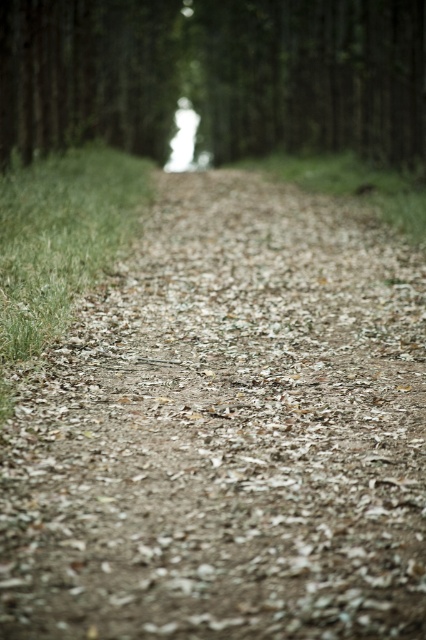
You are a gardener with a 1.5 meter wide lawnmower. You need to mow the area between the brown dirt track at center and the green matte tree at center. Is your lawnmower wide enough to fit through the space between them?

The brown dirt track at center is narrower than the green matte tree at center. However, the question is about the space between them, but the description only states their widths relative to each other, not the distance between them. Therefore, it is impossible to determine if the lawnmower can fit based on the given information.

You are a hiker walking along the narrow dirt path in the image. You want to reach the green matte tree at center. Is the brown dirt track at center blocking your path to the tree?

The brown dirt track at center is in front of the green matte tree at center, so the dirt track is not blocking your path. You can walk along the dirt track to reach the tree.